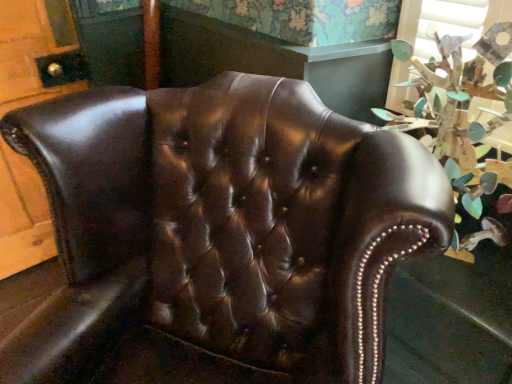
Image resolution: width=512 pixels, height=384 pixels. What do you see at coordinates (225, 231) in the screenshot?
I see `shiny brown leather chair at center` at bounding box center [225, 231].

At what (x,y) coordinates should I click in order to perform the action: click on shiny brown leather chair at center. Please return your answer as a coordinate pair (x, y). Looking at the image, I should click on point(225,231).

The width and height of the screenshot is (512, 384). I want to click on green leafy plant at upper right, so click(x=460, y=109).

What do you see at coordinates (460, 109) in the screenshot?
I see `green leafy plant at upper right` at bounding box center [460, 109].

Find the location of `shiny brown leather chair at center`. shiny brown leather chair at center is located at coordinates (225, 231).

Between green leafy plant at upper right and shiny brown leather chair at center, which one appears on the left side from the viewer's perspective?

A: shiny brown leather chair at center.

Relative to shiny brown leather chair at center, is green leafy plant at upper right in front or behind?

Visually, green leafy plant at upper right is located behind shiny brown leather chair at center.

Which is closer, (458, 52) or (48, 370)?

Answer: Point (458, 52).

From the image's perspective, between green leafy plant at upper right and shiny brown leather chair at center, which one is located above?

green leafy plant at upper right.

From a real-world perspective, which object stands above the other?

green leafy plant at upper right, from a real-world perspective.

Is green leafy plant at upper right thinner than shiny brown leather chair at center?

Indeed, green leafy plant at upper right has a lesser width compared to shiny brown leather chair at center.

From the picture: In terms of height, does green leafy plant at upper right look taller or shorter compared to shiny brown leather chair at center?

In the image, green leafy plant at upper right appears to be shorter than shiny brown leather chair at center.

Which of these two, green leafy plant at upper right or shiny brown leather chair at center, is bigger?

Bigger between the two is shiny brown leather chair at center.

Could shiny brown leather chair at center be considered to be inside green leafy plant at upper right?

No, shiny brown leather chair at center is not inside green leafy plant at upper right.

Consider the image. Is green leafy plant at upper right directly adjacent to shiny brown leather chair at center?

green leafy plant at upper right and shiny brown leather chair at center are clearly separated.

Is green leafy plant at upper right oriented towards shiny brown leather chair at center?

Yes, green leafy plant at upper right faces towards shiny brown leather chair at center.

How many degrees apart are the facing directions of green leafy plant at upper right and shiny brown leather chair at center?

The angular difference between green leafy plant at upper right and shiny brown leather chair at center is 30.4 degrees.

I want to click on chair in front of the green leafy plant at upper right, so click(225, 231).

Considering the relative positions of shiny brown leather chair at center and green leafy plant at upper right in the image provided, is shiny brown leather chair at center to the left of green leafy plant at upper right from the viewer's perspective?

Yes, shiny brown leather chair at center is to the left of green leafy plant at upper right.

In the image, is shiny brown leather chair at center positioned in front of or behind green leafy plant at upper right?

shiny brown leather chair at center is in front of green leafy plant at upper right.

Does point (405, 250) lie behind point (498, 41)?

No.

From the image's perspective, relative to green leafy plant at upper right, is shiny brown leather chair at center above or below?

Based on their image positions, shiny brown leather chair at center is located beneath green leafy plant at upper right.

From a real-world perspective, who is located higher, shiny brown leather chair at center or green leafy plant at upper right?

green leafy plant at upper right is physically above.

Considering the sizes of objects shiny brown leather chair at center and green leafy plant at upper right in the image provided, who is thinner, shiny brown leather chair at center or green leafy plant at upper right?

green leafy plant at upper right is thinner.

Between shiny brown leather chair at center and green leafy plant at upper right, which one has more height?

Standing taller between the two is shiny brown leather chair at center.

Does shiny brown leather chair at center have a smaller size compared to green leafy plant at upper right?

No.

Is shiny brown leather chair at center completely or partially outside of green leafy plant at upper right?

That's correct, shiny brown leather chair at center is outside of green leafy plant at upper right.

Is shiny brown leather chair at center next to green leafy plant at upper right?

No.

Consider the image. Is shiny brown leather chair at center oriented away from green leafy plant at upper right?

Yes, shiny brown leather chair at center's orientation is away from green leafy plant at upper right.

How different are the orientations of shiny brown leather chair at center and green leafy plant at upper right in degrees?

30.4 degrees.

Where is `chair in front of the green leafy plant at upper right`? chair in front of the green leafy plant at upper right is located at coordinates (225, 231).

Where is `floral arrangement behind the shiny brown leather chair at center`? The image size is (512, 384). floral arrangement behind the shiny brown leather chair at center is located at coordinates (460, 109).

Where is `chair lying in front of the green leafy plant at upper right`? This screenshot has width=512, height=384. chair lying in front of the green leafy plant at upper right is located at coordinates (225, 231).